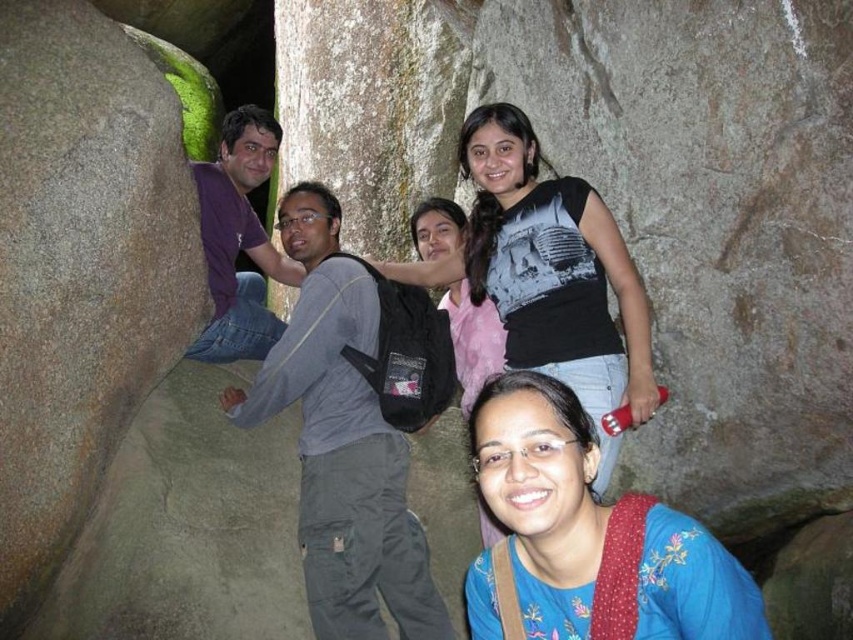
Question: In this image, where is green mossy rock at left located relative to blue embroidered blouse at center?

Choices:
 (A) above
 (B) below

Answer: (A)

Question: Which point is closer to the camera taking this photo?

Choices:
 (A) (701, 188)
 (B) (93, 394)

Answer: (B)

Question: Which point is farther to the camera?

Choices:
 (A) (589, 528)
 (B) (635, 180)

Answer: (B)

Question: In this image, where is green mossy rock at center located relative to green mossy rock at left?

Choices:
 (A) below
 (B) above

Answer: (B)

Question: Based on their relative distances, which object is farther from the green mossy rock at center?

Choices:
 (A) green mossy rock at left
 (B) blue embroidered blouse at center

Answer: (A)

Question: Can you confirm if green mossy rock at left is thinner than blue embroidered blouse at center?

Choices:
 (A) yes
 (B) no

Answer: (A)